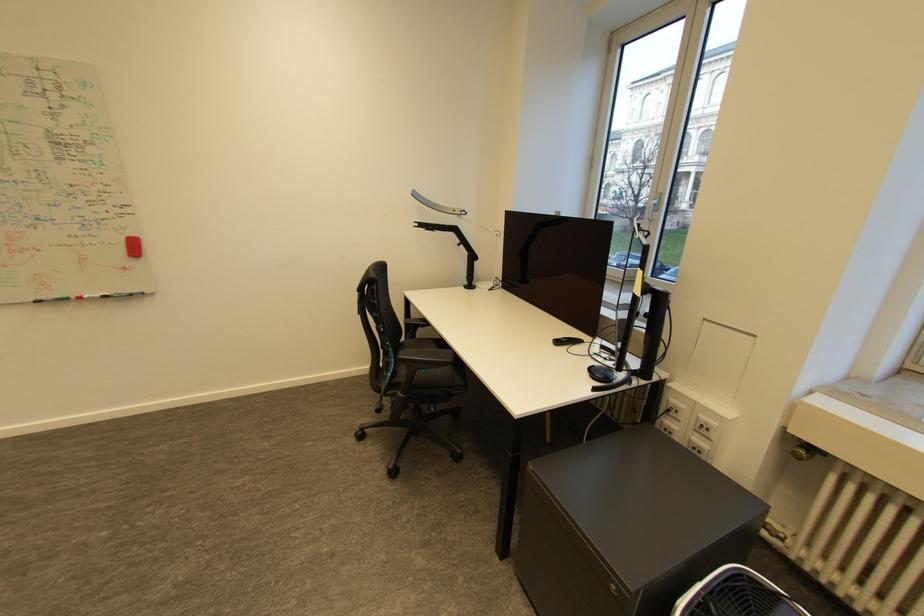
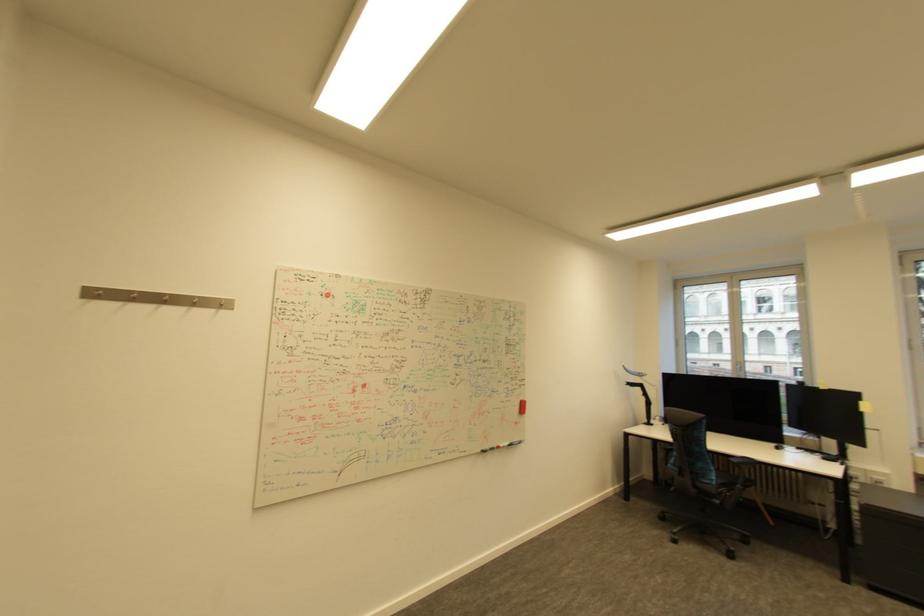
Question: In a continuous first-person perspective shot, in which direction is the camera moving?

Choices:
 (A) Left
 (B) Right
 (C) Forward
 (D) Backward

Answer: (A)